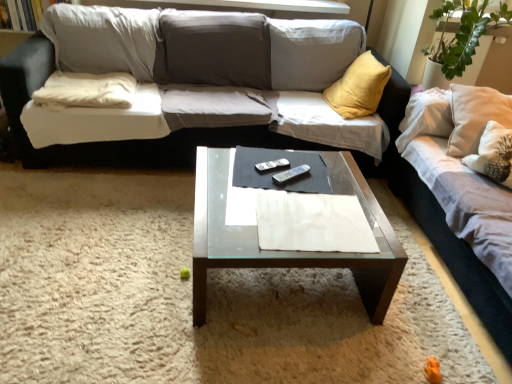
Question: In terms of width, does transparent glass coffee table at center look wider or thinner when compared to white fabric couch at center, positioned as the second studio couch in right-to-left order?

Choices:
 (A) thin
 (B) wide

Answer: (A)

Question: Based on their positions, is transparent glass coffee table at center located to the left or right of white fabric couch at center, placed as the 1th studio couch when sorted from left to right?

Choices:
 (A) right
 (B) left

Answer: (A)

Question: Estimate the real-world distances between objects in this image. Which object is closer to the silver metallic remote at center, marked as the 1th remote in a top-to-bottom arrangement?

Choices:
 (A) light beige fabric couch at right, positioned as the second studio couch in left-to-right order
 (B) transparent glass coffee table at center
 (C) white soft pillow at left
 (D) black plastic remote at center, which is the second remote from top to bottom
 (E) white fabric couch at center, placed as the 1th studio couch when sorted from left to right

Answer: (D)

Question: Considering the real-world distances, which object is farthest from the silver metallic remote at center, marked as the 2th remote in a bottom-to-top arrangement?

Choices:
 (A) light beige fabric couch at right, the 1th studio couch from the right
 (B) black plastic remote at center, which ranks as the first remote in bottom-to-top order
 (C) white fabric couch at center, positioned as the second studio couch in right-to-left order
 (D) white soft pillow at left
 (E) transparent glass coffee table at center

Answer: (D)